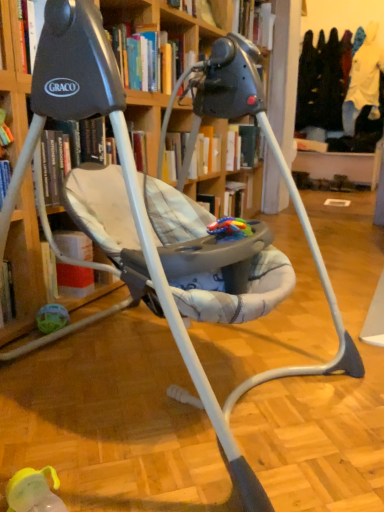
What do you see at coordinates (196, 9) in the screenshot? This screenshot has width=384, height=512. I see `hardcover book at upper center, which ranks as the second book in left-to-right order` at bounding box center [196, 9].

What do you see at coordinates (144, 59) in the screenshot? I see `hardcover book at upper center, marked as the first book in a left-to-right arrangement` at bounding box center [144, 59].

Locate an element on the screen. Image resolution: width=384 pixels, height=512 pixels. hardcover book at upper center, the first book from the right is located at coordinates (255, 22).

Identify the location of hardcover book at upper center, the second book in the front-to-back sequence. Image resolution: width=384 pixels, height=512 pixels. pos(196,9).

Which is closer to the camera, (239, 3) or (212, 19)?

Answer: Clearly, point (239, 3) is more distant from the camera than point (212, 19).

Do you think hardcover book at upper center, the first book viewed from the back, is within hardcover book at upper center, which appears as the 2th book when viewed from the back, or outside of it?

hardcover book at upper center, the first book viewed from the back, is not enclosed by hardcover book at upper center, which appears as the 2th book when viewed from the back.

From the image's perspective, is hardcover book at upper center, which is the third book in left-to-right order, positioned above or below hardcover book at upper center, the second book in the front-to-back sequence?

hardcover book at upper center, which is the third book in left-to-right order, is above hardcover book at upper center, the second book in the front-to-back sequence.

In the scene shown: From a real-world perspective, is hardcover book at upper center, the first book viewed from the back, positioned under hardcover book at upper center, which ranks as the second book in left-to-right order, based on gravity?

Actually, hardcover book at upper center, the first book viewed from the back, is physically above hardcover book at upper center, which ranks as the second book in left-to-right order, in the real world.

Which object is closer to the camera, hardcover book at upper center, which ranks as the second book in bottom-to-top order, or hardcover book at upper center, which ranks as the 3th book in right-to-left order?

hardcover book at upper center, which ranks as the 3th book in right-to-left order, is in front.

Is hardcover book at upper center, which ranks as the second book in left-to-right order, completely or partially outside of hardcover book at upper center, the first book from the front?

Yes, hardcover book at upper center, which ranks as the second book in left-to-right order, is outside of hardcover book at upper center, the first book from the front.

Image resolution: width=384 pixels, height=512 pixels. What are the coordinates of `book beneath the hardcover book at upper center, which ranks as the second book in left-to-right order (from a real-world perspective)` in the screenshot? It's located at point(144,59).

From the image's perspective, who appears lower, hardcover book at upper center, which appears as the 2th book when viewed from the back, or hardcover book at upper center, which ranks as the 3th book in top-to-bottom order?

From the image's view, hardcover book at upper center, which ranks as the 3th book in top-to-bottom order, is below.

From the picture: From a real-world perspective, which is physically above, hardcover book at upper center, placed as the 2th book when sorted from right to left, or hardcover book at upper center, the first book from the right?

From a 3D spatial view, hardcover book at upper center, the first book from the right, is above.

Is hardcover book at upper center, the 2th book when ordered from top to bottom, wider than hardcover book at upper center, the first book viewed from the back?

No.

Are hardcover book at upper center, which ranks as the second book in bottom-to-top order, and hardcover book at upper center, arranged as the 3th book when viewed from the front, far apart?

That's not correct — hardcover book at upper center, which ranks as the second book in bottom-to-top order, is a little close to hardcover book at upper center, arranged as the 3th book when viewed from the front.

Based on the photo, between hardcover book at upper center, the first book from the right, and hardcover book at upper center, which ranks as the 3th book in right-to-left order, which one has more height?

hardcover book at upper center, the first book from the right.

Based on their sizes in the image, would you say hardcover book at upper center, arranged as the 3th book when viewed from the front, is bigger or smaller than hardcover book at upper center, marked as the 1th book in a bottom-to-top arrangement?

In the image, hardcover book at upper center, arranged as the 3th book when viewed from the front, appears to be smaller than hardcover book at upper center, marked as the 1th book in a bottom-to-top arrangement.

From the image's perspective, is hardcover book at upper center, positioned as the third book in bottom-to-top order, located above or below hardcover book at upper center, the first book from the front?

From the image's perspective, hardcover book at upper center, positioned as the third book in bottom-to-top order, appears above hardcover book at upper center, the first book from the front.

Between hardcover book at upper center, the first book viewed from the back, and hardcover book at upper center, which appears as the 3th book when viewed from the back, which one has larger width?

With larger width is hardcover book at upper center, which appears as the 3th book when viewed from the back.

Does hardcover book at upper center, the first book from the front, turn towards hardcover book at upper center, which is the third book in left-to-right order?

No, hardcover book at upper center, the first book from the front, is not aimed at hardcover book at upper center, which is the third book in left-to-right order.

Between hardcover book at upper center, the first book from the front, and hardcover book at upper center, the first book from the right, which one is positioned behind?

hardcover book at upper center, the first book from the right, is more distant.

Measure the distance between hardcover book at upper center, which ranks as the 3th book in right-to-left order, and hardcover book at upper center, positioned as the third book in bottom-to-top order.

The distance of hardcover book at upper center, which ranks as the 3th book in right-to-left order, from hardcover book at upper center, positioned as the third book in bottom-to-top order, is 1.06 meters.

Who is shorter, hardcover book at upper center, which appears as the 3th book when viewed from the back, or hardcover book at upper center, the first book viewed from the back?

Standing shorter between the two is hardcover book at upper center, which appears as the 3th book when viewed from the back.

Considering the relative sizes of hardcover book at upper center, which ranks as the 3th book in right-to-left order, and hardcover book at upper center, placed as the 2th book when sorted from right to left, in the image provided, is hardcover book at upper center, which ranks as the 3th book in right-to-left order, wider than hardcover book at upper center, placed as the 2th book when sorted from right to left,?

Correct, the width of hardcover book at upper center, which ranks as the 3th book in right-to-left order, exceeds that of hardcover book at upper center, placed as the 2th book when sorted from right to left.

Is hardcover book at upper center, which ranks as the 3th book in right-to-left order, further to camera compared to hardcover book at upper center, which appears as the 2th book when viewed from the back?

No.

From the picture: Is hardcover book at upper center, which ranks as the 3th book in right-to-left order, far from hardcover book at upper center, which ranks as the second book in left-to-right order?

No, hardcover book at upper center, which ranks as the 3th book in right-to-left order, is not far away from hardcover book at upper center, which ranks as the second book in left-to-right order.

This screenshot has height=512, width=384. I want to click on the 1st book counting from the left of the hardcover book at upper center, the first book viewed from the back, so tap(196, 9).

At what (x,y) coordinates should I click in order to perform the action: click on book below the hardcover book at upper center, the 2th book when ordered from top to bottom (from a real-world perspective). Please return your answer as a coordinate pair (x, y). Looking at the image, I should click on (144, 59).

Which object lies nearer to the anchor point hardcover book at upper center, which appears as the 2th book when viewed from the back, hardcover book at upper center, which ranks as the 3th book in right-to-left order, or hardcover book at upper center, the first book from the right?

The object closer to hardcover book at upper center, which appears as the 2th book when viewed from the back, is hardcover book at upper center, which ranks as the 3th book in right-to-left order.

Looking at the image, which one is located closer to hardcover book at upper center, which is the third book in left-to-right order, hardcover book at upper center, marked as the 1th book in a bottom-to-top arrangement, or hardcover book at upper center, the 2th book when ordered from top to bottom?

The object closer to hardcover book at upper center, which is the third book in left-to-right order, is hardcover book at upper center, the 2th book when ordered from top to bottom.

From the image, which object appears to be nearer to hardcover book at upper center, which appears as the 2th book when viewed from the back, hardcover book at upper center, positioned as the third book in bottom-to-top order, or hardcover book at upper center, marked as the 1th book in a bottom-to-top arrangement?

Among the two, hardcover book at upper center, marked as the 1th book in a bottom-to-top arrangement, is located nearer to hardcover book at upper center, which appears as the 2th book when viewed from the back.

From the image, which object appears to be farther from hardcover book at upper center, the first book from the front, hardcover book at upper center, which ranks as the second book in left-to-right order, or hardcover book at upper center, the first book from the right?

hardcover book at upper center, the first book from the right, is positioned further to the anchor hardcover book at upper center, the first book from the front.

Considering their positions, is hardcover book at upper center, the second book in the front-to-back sequence, positioned further to hardcover book at upper center, positioned as the third book in bottom-to-top order, than hardcover book at upper center, marked as the first book in a left-to-right arrangement?

Based on the image, hardcover book at upper center, marked as the first book in a left-to-right arrangement, appears to be further to hardcover book at upper center, positioned as the third book in bottom-to-top order.

Considering their positions, is hardcover book at upper center, the first book viewed from the back, positioned closer to hardcover book at upper center, which appears as the 3th book when viewed from the back, than hardcover book at upper center, the second book in the front-to-back sequence?

Among the two, hardcover book at upper center, the second book in the front-to-back sequence, is located nearer to hardcover book at upper center, which appears as the 3th book when viewed from the back.

The width and height of the screenshot is (384, 512). Identify the location of book located between hardcover book at upper center, which appears as the 3th book when viewed from the back, and hardcover book at upper center, which is the third book in left-to-right order, in the depth direction. (196, 9).